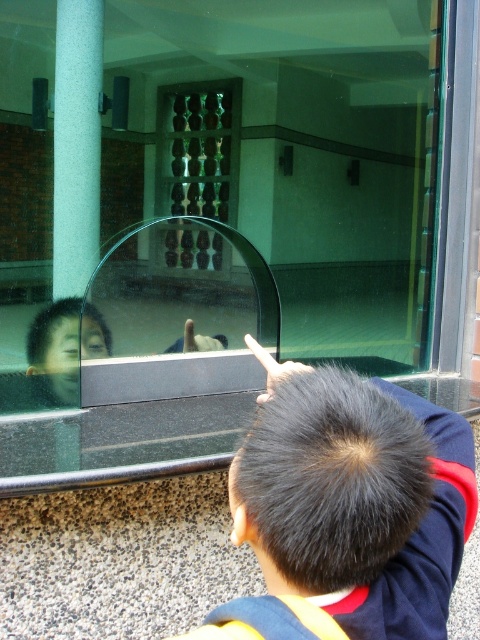
Is point (288, 376) more distant than point (60, 36)?

No.

Who is shorter, dark brown hair at upper right or green textured pillar at left?

With less height is dark brown hair at upper right.

Identify the location of dark brown hair at upper right. (355, 499).